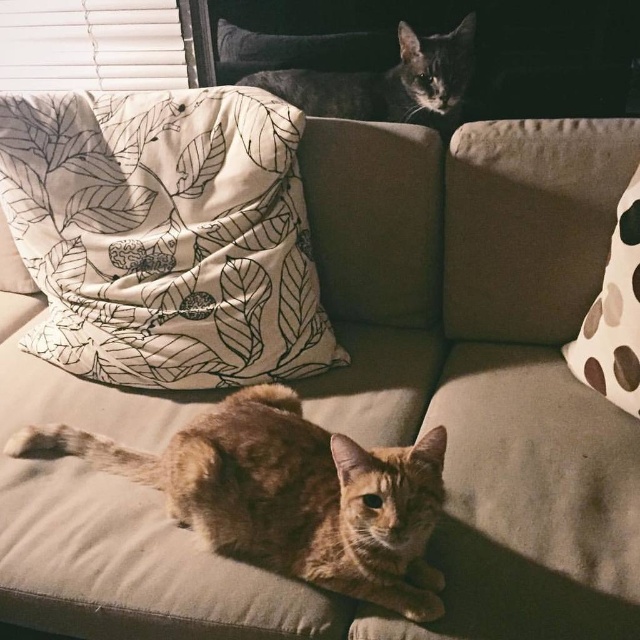
You are trying to place a new small blanket on the sofa. You need to know if there is enough space between the gray fur cat at upper center and the white dotted pillow at right. Can you determine if the space between them is sufficient for the blanket?

The gray fur cat at upper center might be wider than the white dotted pillow at right, so the space between them may not be sufficient for the blanket.

You are arranging flowers on the sofa and need to place a vase between the white fabric pillow with leaf pattern at upper left and the white dotted pillow at right. Based on their positions, which pillow should the vase be closer to?

The vase should be placed closer to the white fabric pillow with leaf pattern at upper left since it is positioned to the left of the white dotted pillow at right.

You are arranging a photo shoot and need to place a small vase between the two pillows. The white fabric pillow with leaf pattern at upper left and the white dotted pillow at right. Which pillow should the vase be placed closer to if you want it to be near the larger pillow?

The white fabric pillow with leaf pattern at upper left is larger, so placing the vase closer to it would position it near the larger pillow.